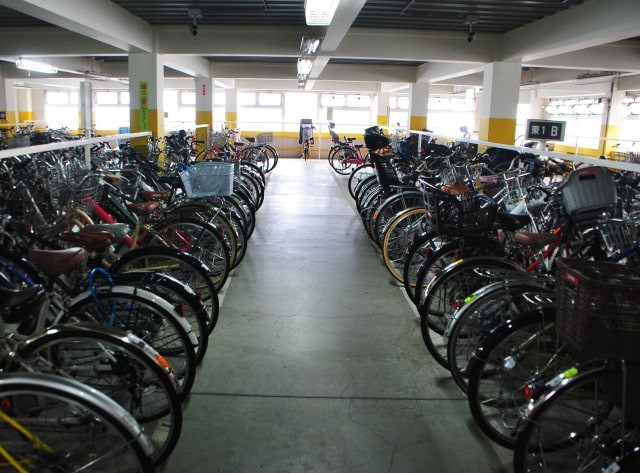
The width and height of the screenshot is (640, 473). Find the location of `lights`. lights is located at coordinates (32, 64), (312, 9), (306, 69).